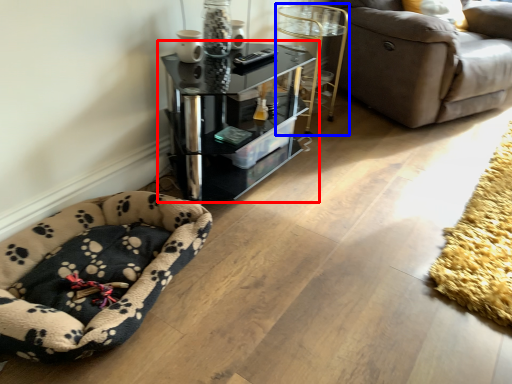
Question: Which object appears closest to the camera in this image, table (highlighted by a red box) or side table (highlighted by a blue box)?

Choices:
 (A) table
 (B) side table

Answer: (A)